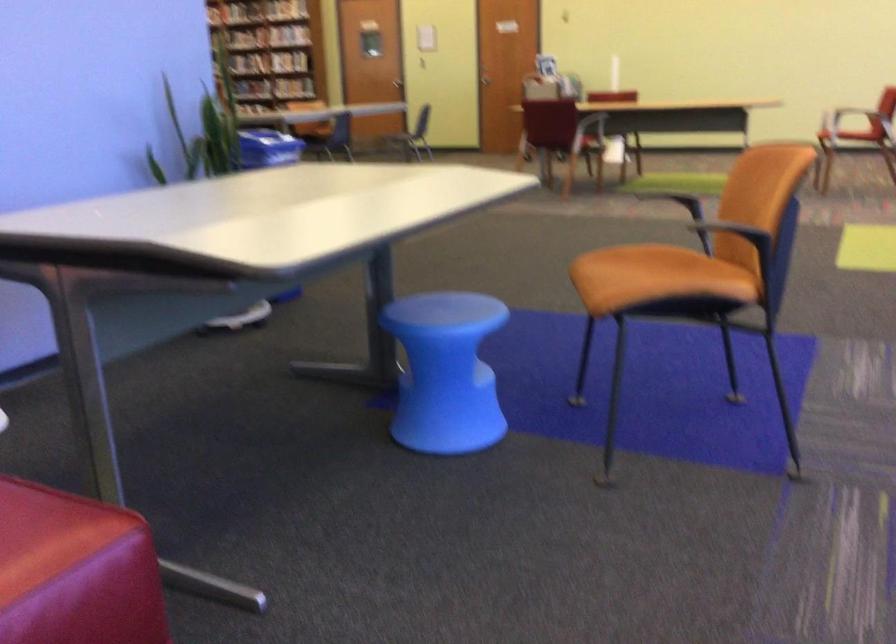
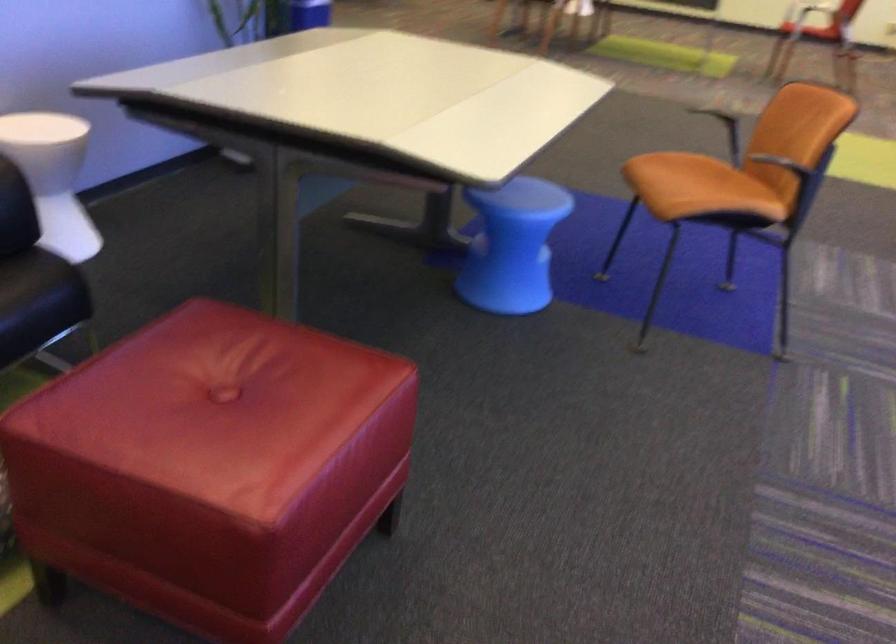
In the second image, find the point that corresponds to (669,265) in the first image.

(711, 173)